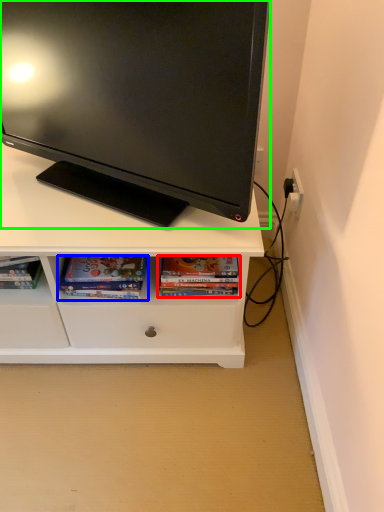
Question: Based on their relative distances, which object is farther from book (highlighted by a red box)? Choose from book (highlighted by a blue box) and television (highlighted by a green box).

Choices:
 (A) book
 (B) television

Answer: (B)